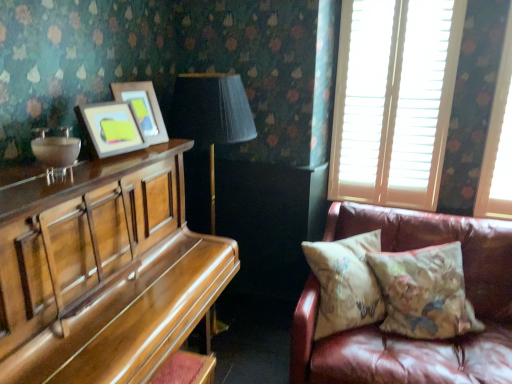
Question: Can you confirm if matte wooden picture frame at upper left, the second picture frame in the front-to-back sequence, is smaller than white wooden blinds at upper right?

Choices:
 (A) no
 (B) yes

Answer: (B)

Question: Is matte wooden picture frame at upper left, positioned as the 1th picture frame in back-to-front order, positioned with its back to white wooden blinds at upper right?

Choices:
 (A) yes
 (B) no

Answer: (B)

Question: Does matte wooden picture frame at upper left, the second picture frame in the front-to-back sequence, have a greater width compared to white wooden blinds at upper right?

Choices:
 (A) no
 (B) yes

Answer: (B)

Question: Considering the relative sizes of matte wooden picture frame at upper left, the second picture frame in the front-to-back sequence, and white wooden blinds at upper right in the image provided, is matte wooden picture frame at upper left, the second picture frame in the front-to-back sequence, bigger than white wooden blinds at upper right?

Choices:
 (A) no
 (B) yes

Answer: (A)

Question: From a real-world perspective, is matte wooden picture frame at upper left, the second picture frame in the front-to-back sequence, beneath white wooden blinds at upper right?

Choices:
 (A) yes
 (B) no

Answer: (B)

Question: In the image, is shiny brown piano at left on the left side or the right side of floral-patterned fabric pillow at right, positioned as the 1th pillow in right-to-left order?

Choices:
 (A) left
 (B) right

Answer: (A)

Question: In terms of width, does shiny brown piano at left look wider or thinner when compared to floral-patterned fabric pillow at right, positioned as the 1th pillow in right-to-left order?

Choices:
 (A) thin
 (B) wide

Answer: (B)

Question: Is shiny brown piano at left bigger or smaller than floral-patterned fabric pillow at right, positioned as the 1th pillow in right-to-left order?

Choices:
 (A) big
 (B) small

Answer: (A)

Question: Does point (197, 268) appear closer or farther from the camera than point (461, 269)?

Choices:
 (A) closer
 (B) farther

Answer: (A)

Question: Looking at the image, does leather couch at right seem bigger or smaller compared to white wooden blinds at upper right?

Choices:
 (A) big
 (B) small

Answer: (A)

Question: Considering the positions of point [361, 337] and point [433, 96], is point [361, 337] closer or farther from the camera than point [433, 96]?

Choices:
 (A) farther
 (B) closer

Answer: (B)

Question: From a real-world perspective, is leather couch at right above or below white wooden blinds at upper right?

Choices:
 (A) above
 (B) below

Answer: (B)

Question: From the image's perspective, is leather couch at right positioned above or below white wooden blinds at upper right?

Choices:
 (A) below
 (B) above

Answer: (A)

Question: Considering the positions of shiny brown piano at left and leather couch at right in the image, is shiny brown piano at left taller or shorter than leather couch at right?

Choices:
 (A) short
 (B) tall

Answer: (B)

Question: Considering the positions of shiny brown piano at left and leather couch at right in the image, is shiny brown piano at left wider or thinner than leather couch at right?

Choices:
 (A) thin
 (B) wide

Answer: (A)